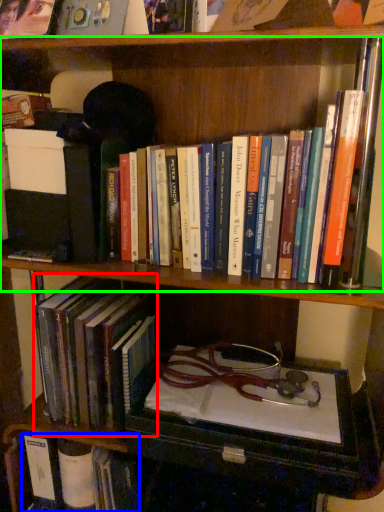
Question: Which object is the closest to the book (highlighted by a red box)? Choose among these: book (highlighted by a blue box) or book (highlighted by a green box).

Choices:
 (A) book
 (B) book

Answer: (A)